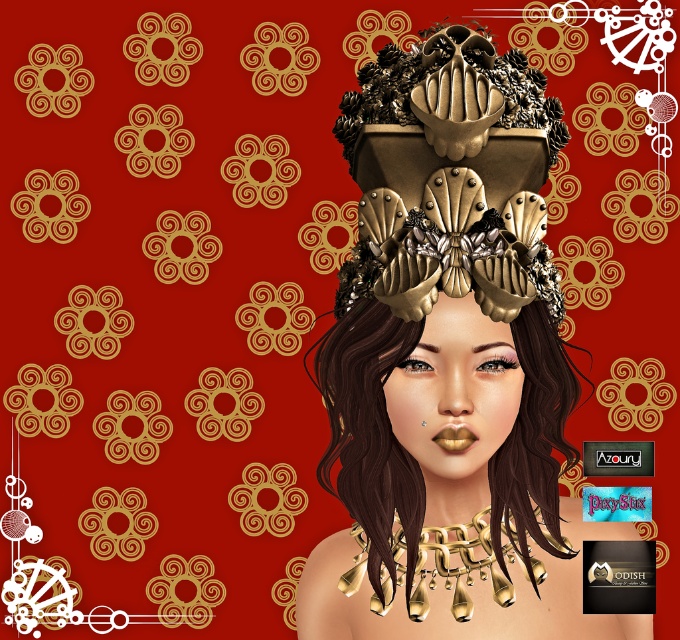
Where is the gold metallic headdress at center located in the image?

The gold metallic headdress at center is located at point coordinates of (449, 250).

Based on the description provided, which object is bigger between the gold metallic headdress at center and the gold metallic necklace at lower center?

The gold metallic headdress at center is larger in size compared to the gold metallic necklace at lower center.